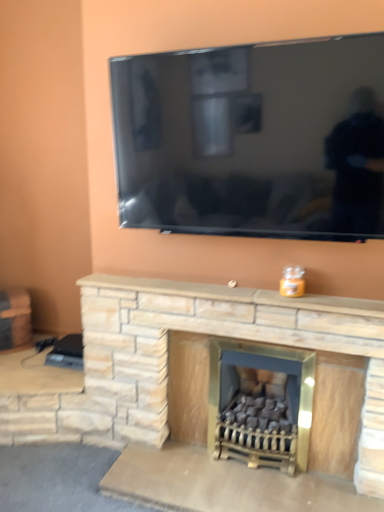
This screenshot has width=384, height=512. Find the location of `blank space situated above natural stone fireplace at center (from a real-world perspective)`. blank space situated above natural stone fireplace at center (from a real-world perspective) is located at coordinates (207, 288).